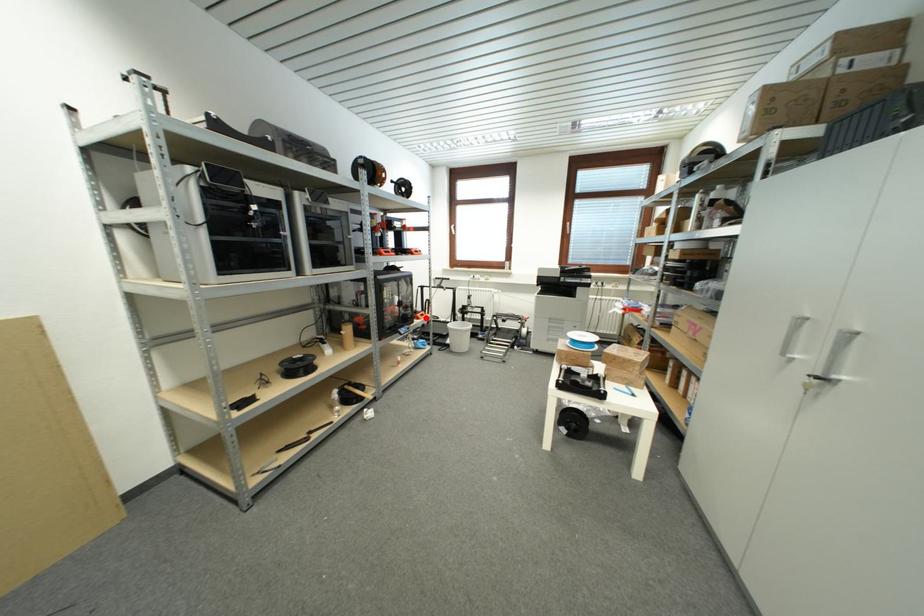
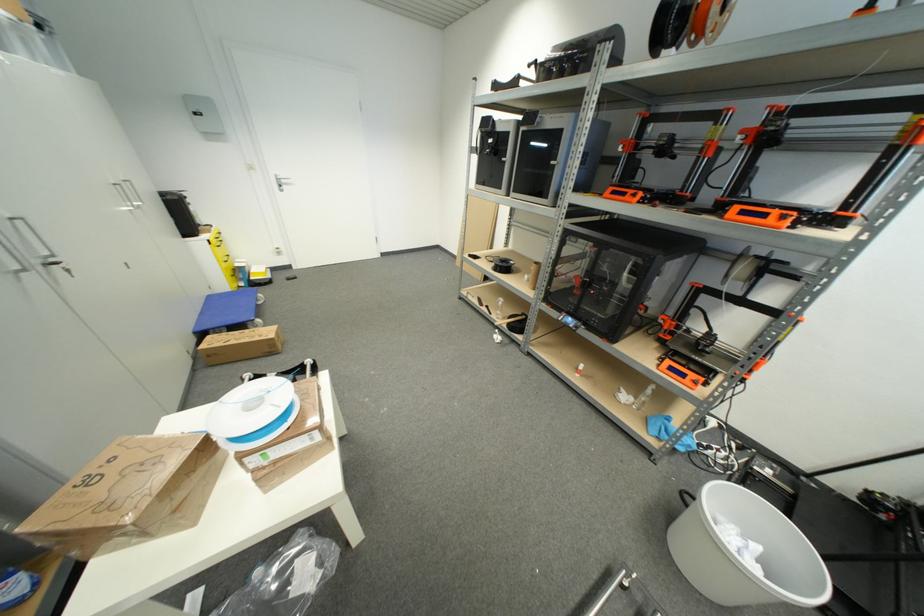
Question: I am providing you with two images of the same scene from different viewpoints. Given a red point in image1, look at the same physical point in image2. Is it:

Choices:
 (A) Closer to the viewpoint
 (B) Farther from the viewpoint

Answer: (B)